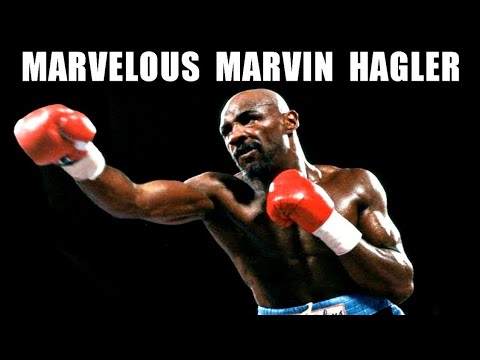
The width and height of the screenshot is (480, 360). I want to click on chest, so click(x=270, y=250).